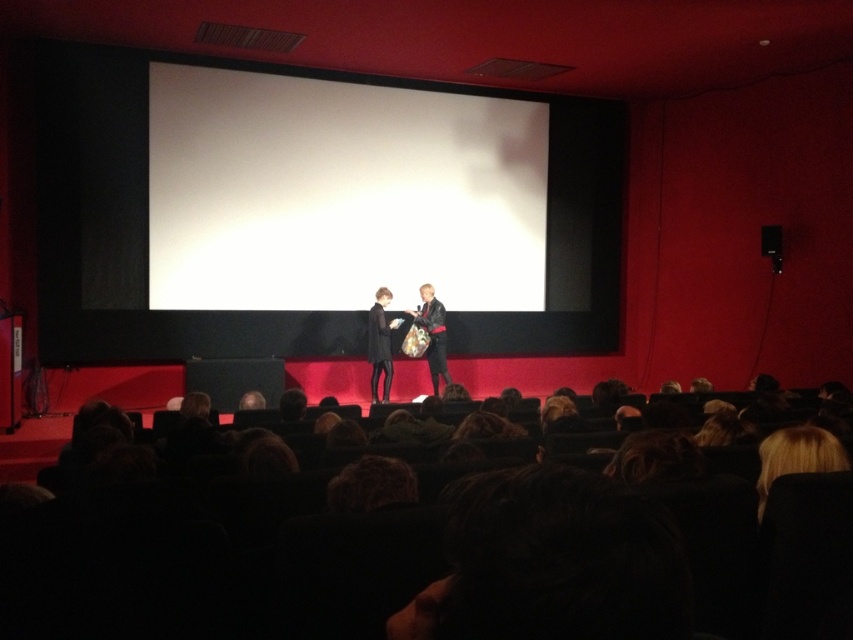
In the scene shown: Is black leather jacket at center to the left of black plastic speaker at upper right from the viewer's perspective?

Yes, black leather jacket at center is to the left of black plastic speaker at upper right.

Is black leather jacket at center shorter than black plastic speaker at upper right?

No.

Locate an element on the screen. The height and width of the screenshot is (640, 853). black leather jacket at center is located at coordinates (380, 342).

Between leather jacket at center and black plastic speaker at upper right, which one has more height?

leather jacket at center is taller.

Measure the distance between point (438, 330) and camera.

7.55 meters

Locate an element on the screen. The width and height of the screenshot is (853, 640). leather jacket at center is located at coordinates (432, 333).

Is point (373, 380) closer to viewer compared to point (437, 337)?

No, it is behind (437, 337).

Which is in front, point (386, 330) or point (432, 353)?

Point (386, 330) is more forward.

Does point (373, 396) come behind point (434, 342)?

Yes.

Where is `black leather jacket at center`? The image size is (853, 640). black leather jacket at center is located at coordinates (380, 342).